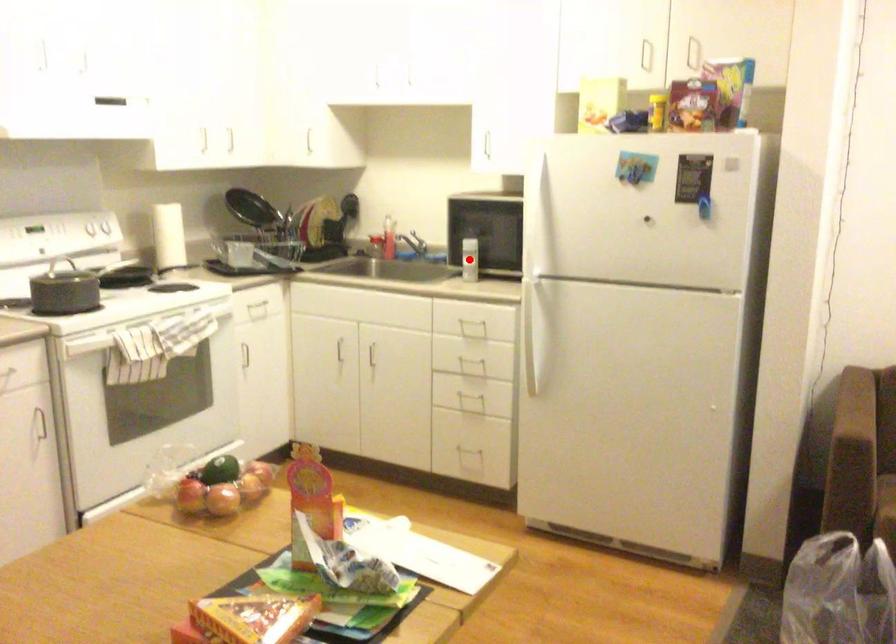
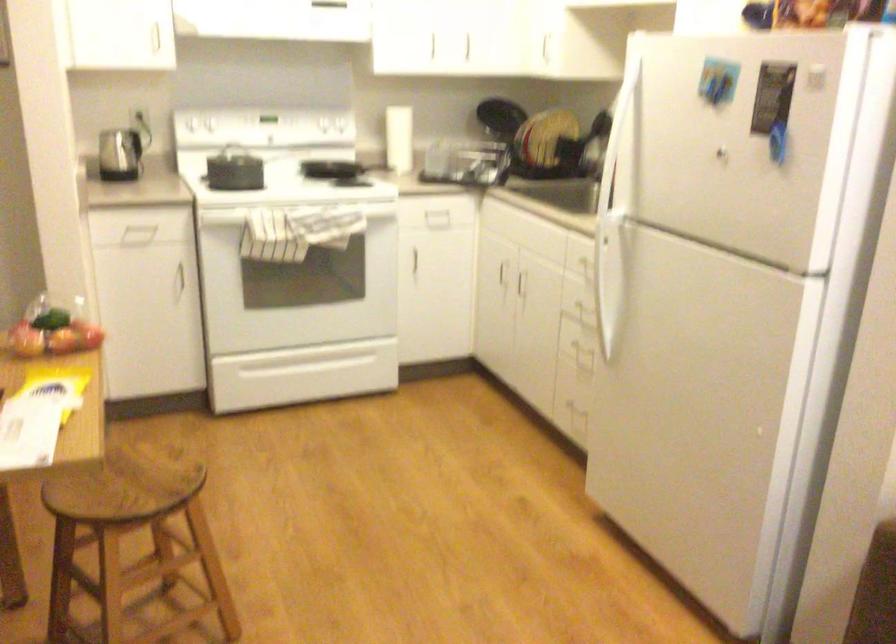
Question: I am providing you with two images of the same scene from different viewpoints. A red point is marked on the first image. Is the red point's position out of view in image 2?

Choices:
 (A) Yes
 (B) No

Answer: (A)